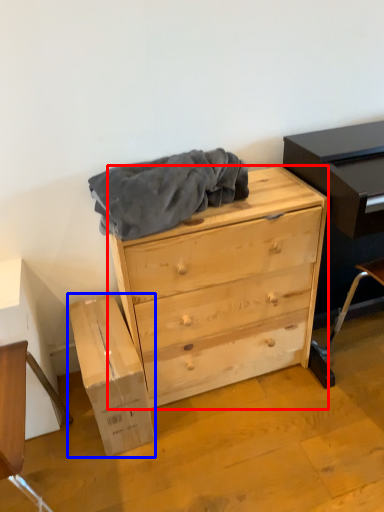
Question: Which object is closer to the camera taking this photo, chest of drawers (highlighted by a red box) or cardboard box (highlighted by a blue box)?

Choices:
 (A) chest of drawers
 (B) cardboard box

Answer: (A)